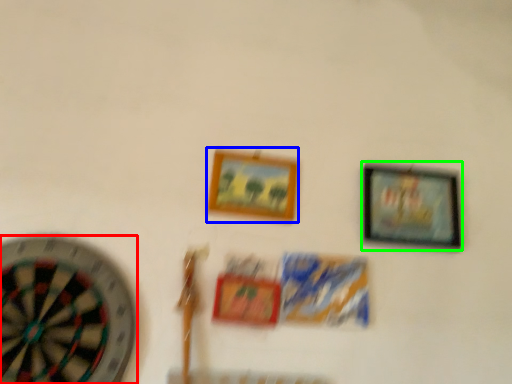
Question: Estimate the real-world distances between objects in this image. Which object is closer to wheel (highlighted by a red box), picture frame (highlighted by a blue box) or picture frame (highlighted by a green box)?

Choices:
 (A) picture frame
 (B) picture frame

Answer: (A)